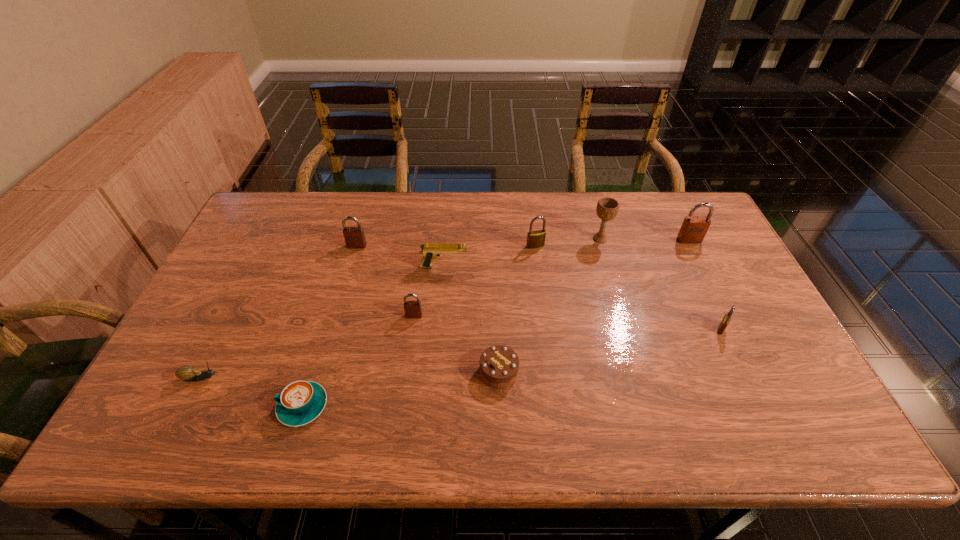
Identify which padlock is located as the nearest to the pistol. Please provide its 2D coordinates. Your answer should be formatted as a tuple, i.e. [(x, y)], where the tuple contains the x and y coordinates of a point satisfying the conditions above.

[(413, 309)]

Identify which brown padlock is located as the second nearest to the second smallest brown padlock. Please provide its 2D coordinates. Your answer should be formatted as a tuple, i.e. [(x, y)], where the tuple contains the x and y coordinates of a point satisfying the conditions above.

[(694, 228)]

Select which brown padlock appears as the third closest to the fourth nearest object. Please provide its 2D coordinates. Your answer should be formatted as a tuple, i.e. [(x, y)], where the tuple contains the x and y coordinates of a point satisfying the conditions above.

[(354, 237)]

The height and width of the screenshot is (540, 960). Find the location of `vacant position in the image that satisfies the following two spatial constraints: 1. at the barrel of the sixth object from left to right; 2. on the right side of the fifth farthest object`. vacant position in the image that satisfies the following two spatial constraints: 1. at the barrel of the sixth object from left to right; 2. on the right side of the fifth farthest object is located at coordinates (435, 372).